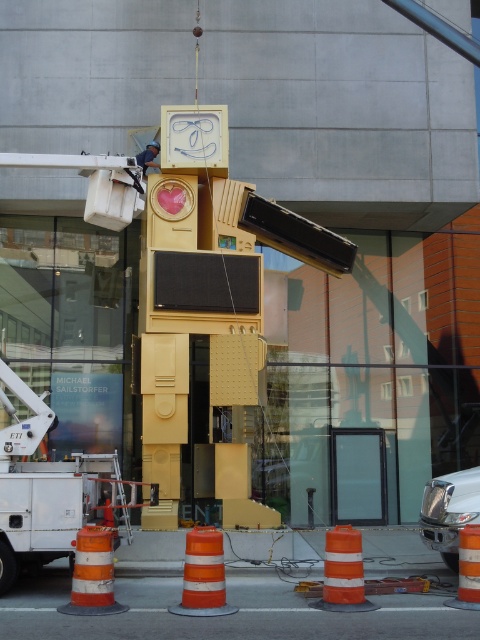
Is point (199, 566) farther from camera compared to point (350, 576)?

No, it is in front of (350, 576).

Does orange reflective cone at lower center have a larger size compared to orange/white striped traffic cone at lower center?

Yes, orange reflective cone at lower center is bigger than orange/white striped traffic cone at lower center.

Who is more forward, (183, 577) or (333, 556)?

Point (333, 556)

Where is `orange reflective cone at lower center`? orange reflective cone at lower center is located at coordinates (204, 576).

Which of these two, orange/white striped traffic cone at lower center or orange reflective cone at center, stands taller?

orange/white striped traffic cone at lower center

Image resolution: width=480 pixels, height=640 pixels. What are the coordinates of `orange/white striped traffic cone at lower center` in the screenshot? It's located at (344, 572).

Is point (331, 563) closer to viewer compared to point (472, 566)?

Yes, point (331, 563) is closer to viewer.

This screenshot has height=640, width=480. Find the location of `orange/white striped traffic cone at lower center`. orange/white striped traffic cone at lower center is located at coordinates (344, 572).

Measure the distance between point (x=17, y=465) and camera.

Point (x=17, y=465) is 10.75 meters from camera.

Does white metallic utility truck at lower left have a greater width compared to orange reflective cone at center?

Correct, the width of white metallic utility truck at lower left exceeds that of orange reflective cone at center.

Is point (47, 428) more distant than point (474, 541)?

That is True.

Image resolution: width=480 pixels, height=640 pixels. I want to click on white metallic utility truck at lower left, so click(41, 488).